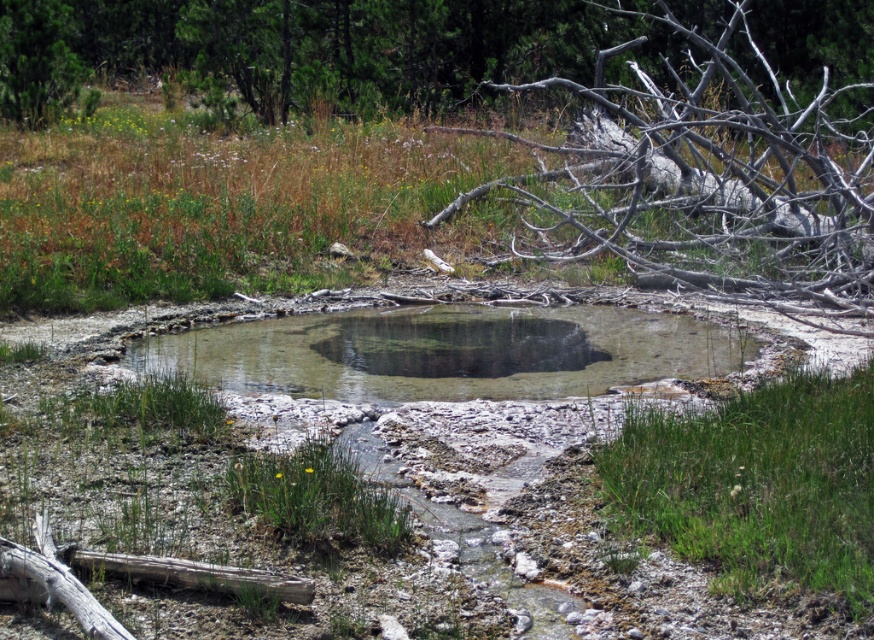
You are a hiker carrying a 20kg backpack and need to collect water from the clear water hole at center. The green leafy tree at upper center provides shade. Can you comfortably walk from the tree to the water hole without getting too tired?

The distance between the green leafy tree at upper center and the clear water hole at center is 13.81 meters. Carrying a 20kg backpack for this short distance should not cause significant fatigue, so you can comfortably walk between them.

You are standing at the edge of the pool and looking towards the upper part of the image. Which tree, the gray bark tree at upper right or the green leafy tree at upper center, is positioned more to your right side?

The gray bark tree at upper right is positioned to the right of the green leafy tree at upper center, so the gray bark tree at upper right is more to your right side.

You are standing at the edge of the clear water hole at center and want to reach the green leafy tree at upper center. In which direction should you walk to get there?

You should walk to the left to reach the green leafy tree at upper center because it is located to the left of the clear water hole at center.